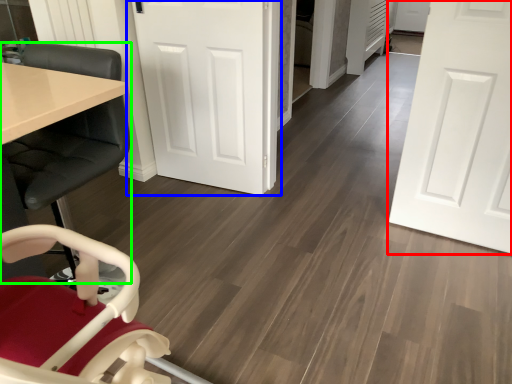
Question: Which object is positioned farthest from door (highlighted by a red box)? Select from door (highlighted by a blue box) and chair (highlighted by a green box).

Choices:
 (A) door
 (B) chair

Answer: (B)